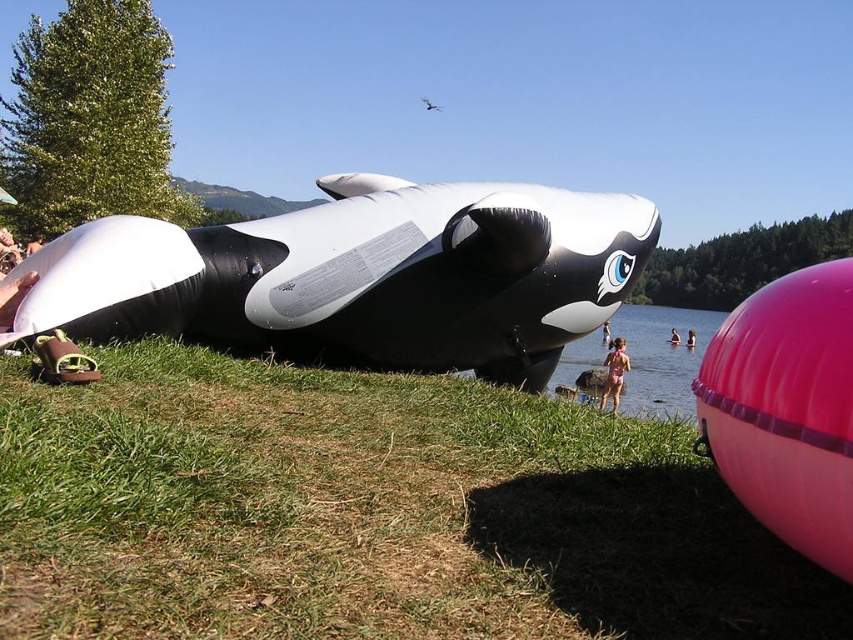
Question: From the image, what is the correct spatial relationship of green grass at lower left in relation to black rubber whale at center?

Choices:
 (A) above
 (B) below

Answer: (B)

Question: Is pink fabric swimsuit at lower center thinner than pink rubber tube at lower right?

Choices:
 (A) yes
 (B) no

Answer: (B)

Question: Which point is closer to the camera taking this photo?

Choices:
 (A) coord(621,358)
 (B) coord(692,332)

Answer: (A)

Question: Which of the following is the farthest from the observer?

Choices:
 (A) green grass at lower left
 (B) pink fabric swimsuit at lower center
 (C) pink rubber tube at lower right
 (D) pink fabric person at lower center

Answer: (C)

Question: Is pink fabric swimsuit at lower center below pink fabric person at lower center?

Choices:
 (A) yes
 (B) no

Answer: (A)

Question: Which point is farther to the camera?

Choices:
 (A) (611, 385)
 (B) (676, 332)

Answer: (B)